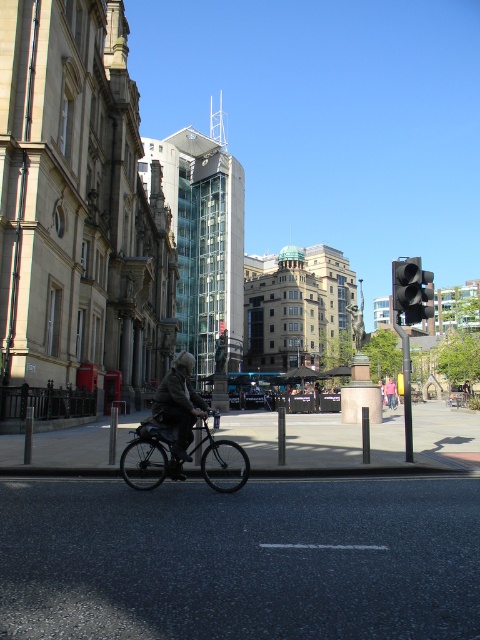
You are a drone operator trying to deliver a package. Your drone is at point (x=151, y=486) and needs to fly to point (x=396, y=282). Considering the urban scene described, will the drone have to fly over any buildings or obstacles between these two points?

Point (x=151, y=486) is in front of point (x=396, y=282), so the drone will not have to fly over any buildings or obstacles between these two points since the starting point is closer to the observer than the destination.

You are a pedestrian standing at the point marked by the coordinates point (149, 456). You want to cross the road to reach the red telephone booth on the left. Is the shiny metallic bicycle at center blocking your path?

The point (149, 456) indicates the shiny metallic bicycle at center, so you are currently standing right where the shiny metallic bicycle at center is located. Therefore, the shiny metallic bicycle at center is not blocking your path because you are already there.

You are a delivery drone flying at an altitude of 50 meters above the scene. You need to land precisely on the shiny metallic bicycle at center. What are the coordinates where you should aim to land?

The coordinates for the shiny metallic bicycle at center are at point (149, 456), so you should aim for those coordinates to land precisely on it.